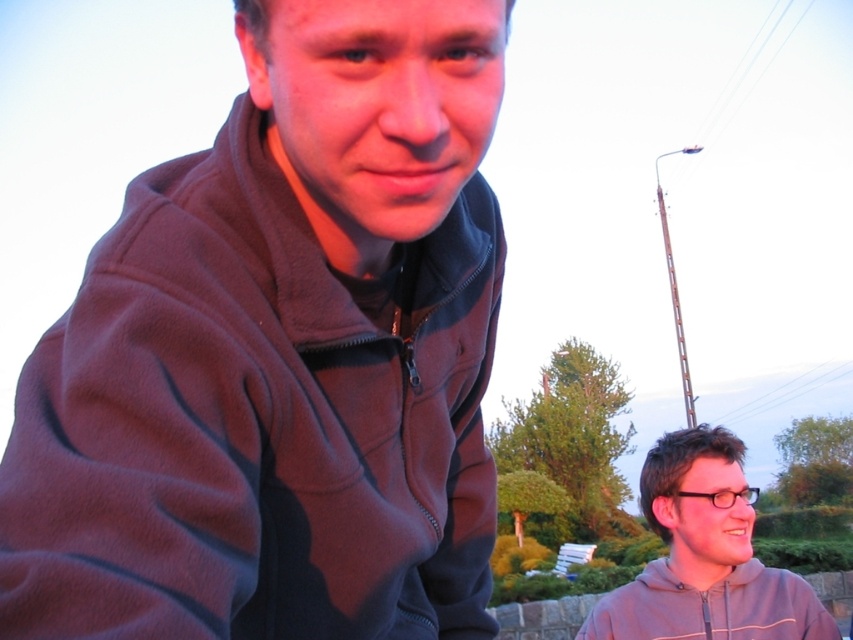
Between gray matte hoodie at lower right and gray fleece sweatshirt at lower right, which one appears on the right side from the viewer's perspective?

Positioned to the right is gray fleece sweatshirt at lower right.

Describe the element at coordinates (705, 556) in the screenshot. I see `gray matte hoodie at lower right` at that location.

The width and height of the screenshot is (853, 640). Find the location of `gray matte hoodie at lower right`. gray matte hoodie at lower right is located at coordinates (705, 556).

Does point (494, 520) come in front of point (715, 608)?

Yes, point (494, 520) is closer to viewer.

The width and height of the screenshot is (853, 640). I want to click on dark fleece jacket at upper left, so click(280, 356).

Between dark fleece jacket at upper left and gray fleece sweatshirt at lower right, which one has less height?

Standing shorter between the two is gray fleece sweatshirt at lower right.

Consider the image. Between dark fleece jacket at upper left and gray fleece sweatshirt at lower right, which one is positioned lower?

Positioned lower is gray fleece sweatshirt at lower right.

Is point (108, 564) closer to camera compared to point (782, 625)?

Yes, point (108, 564) is closer to viewer.

Locate an element on the screen. The image size is (853, 640). dark fleece jacket at upper left is located at coordinates (280, 356).